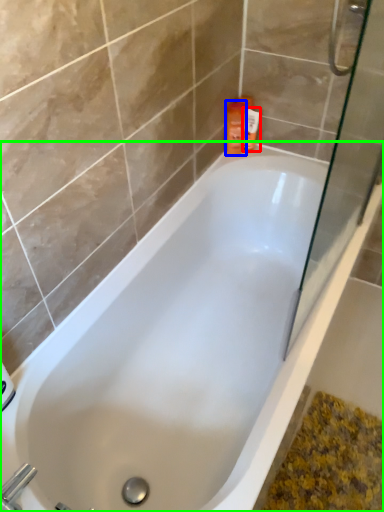
Question: Considering the real-world distances, which object is farthest from toiletry (highlighted by a red box)? cleaning product (highlighted by a blue box) or bathtub (highlighted by a green box)?

Choices:
 (A) cleaning product
 (B) bathtub

Answer: (B)